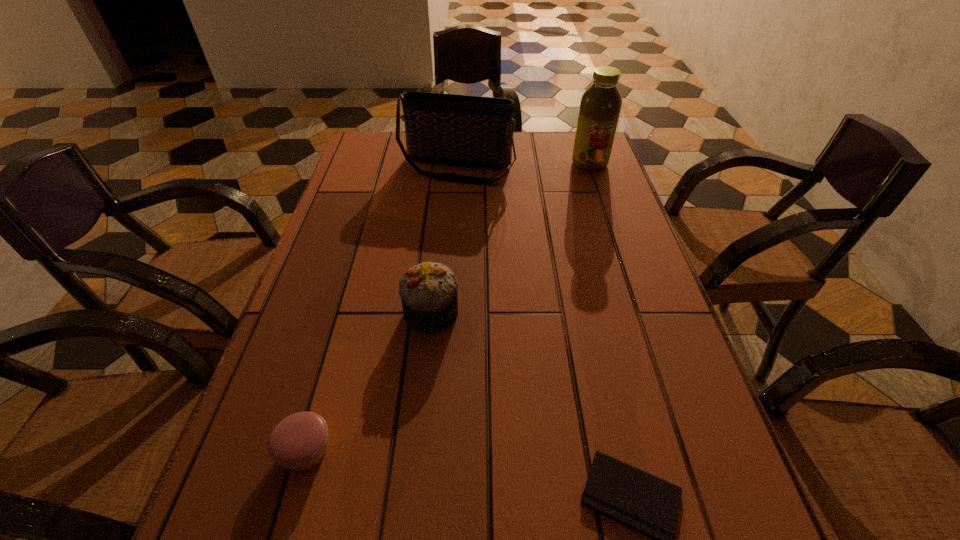
Where is `vacant space at the far left corner`? vacant space at the far left corner is located at coordinates (402, 169).

Where is `free space at the far right corner`? This screenshot has height=540, width=960. free space at the far right corner is located at coordinates (609, 163).

You are a GUI agent. You are given a task and a screenshot of the screen. Output one action in this format:
    pyautogui.click(x=<x>, y=<y>)
    Task: Click on the free space between the fruit juice and the handbag
    The height and width of the screenshot is (540, 960).
    Given the screenshot: What is the action you would take?
    pyautogui.click(x=523, y=166)

At what (x,y) coordinates should I click in order to perform the action: click on free spot between the farther cupcake and the fourth shortest object. Please return your answer as a coordinate pair (x, y). The height and width of the screenshot is (540, 960). Looking at the image, I should click on [x=444, y=241].

The image size is (960, 540). I want to click on free space between the taller cupcake and the shorter cupcake, so click(369, 382).

Image resolution: width=960 pixels, height=540 pixels. What are the coordinates of `unoccupied area between the left cupcake and the fourth shortest object` in the screenshot? It's located at (381, 310).

Where is `vacant space in between the left cupcake and the fourth shortest object`? The image size is (960, 540). vacant space in between the left cupcake and the fourth shortest object is located at coordinates (381, 310).

Find the location of `vacant space that's between the tallest object and the taller cupcake`. vacant space that's between the tallest object and the taller cupcake is located at coordinates (511, 238).

Select which object is the fourth closest to the fourth shortest object. Please provide its 2D coordinates. Your answer should be formatted as a tuple, i.e. [(x, y)], where the tuple contains the x and y coordinates of a point satisfying the conditions above.

[(650, 505)]

Identify which object is the closest to the handbag. Please provide its 2D coordinates. Your answer should be formatted as a tuple, i.e. [(x, y)], where the tuple contains the x and y coordinates of a point satisfying the conditions above.

[(600, 106)]